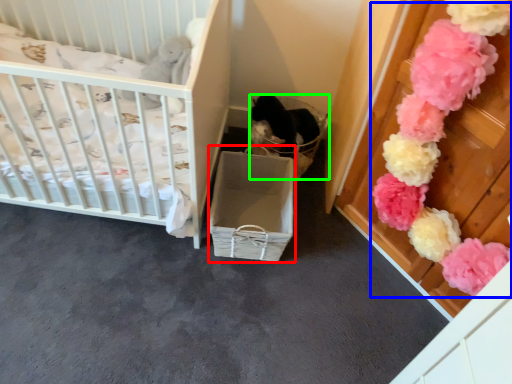
Question: Which object is the closest to the crate (highlighted by a red box)? Choose among these: flower (highlighted by a blue box) or basket (highlighted by a green box).

Choices:
 (A) flower
 (B) basket

Answer: (B)